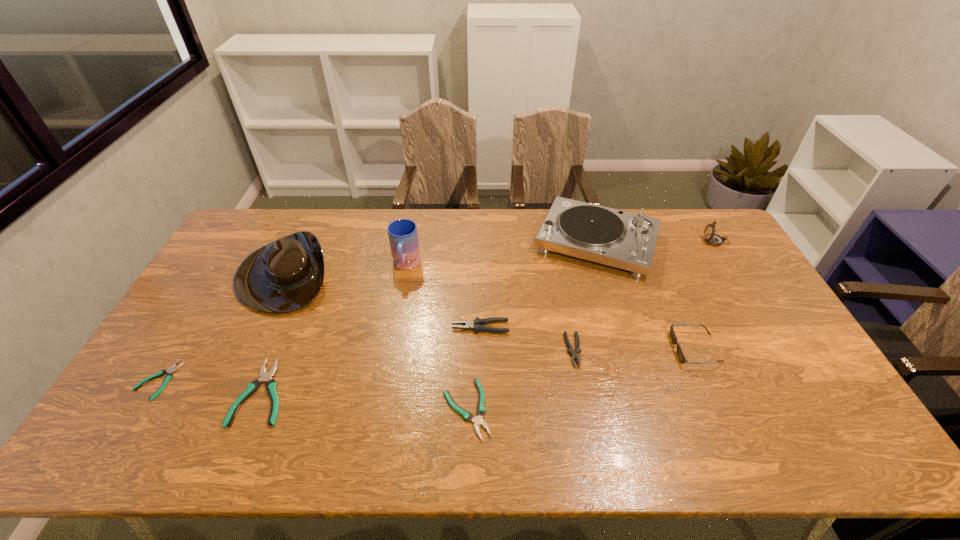
You are a GUI agent. You are given a task and a screenshot of the screen. Output one action in this format:
    pyautogui.click(x=<x>, y=<y>)
    Task: Click on the seventh object from right to left
    
    Given the screenshot: What is the action you would take?
    pyautogui.click(x=403, y=236)

The height and width of the screenshot is (540, 960). In order to click on the tallest object in this screenshot , I will do `click(403, 236)`.

Where is `record player`? Image resolution: width=960 pixels, height=540 pixels. record player is located at coordinates (621, 239).

The height and width of the screenshot is (540, 960). What are the coordinates of `the rightmost object` in the screenshot? It's located at (711, 238).

Where is `cowboy hat`? Image resolution: width=960 pixels, height=540 pixels. cowboy hat is located at coordinates pos(283,276).

This screenshot has width=960, height=540. I want to click on black sunglasses, so click(x=680, y=354).

The height and width of the screenshot is (540, 960). I want to click on sunglasses, so click(680, 354).

The width and height of the screenshot is (960, 540). What are the coordinates of `the left gray pliers` in the screenshot? It's located at (476, 325).

This screenshot has width=960, height=540. In order to click on the sixth tallest object in this screenshot , I will do `click(476, 325)`.

Image resolution: width=960 pixels, height=540 pixels. I want to click on the smaller gray pliers, so click(x=570, y=350).